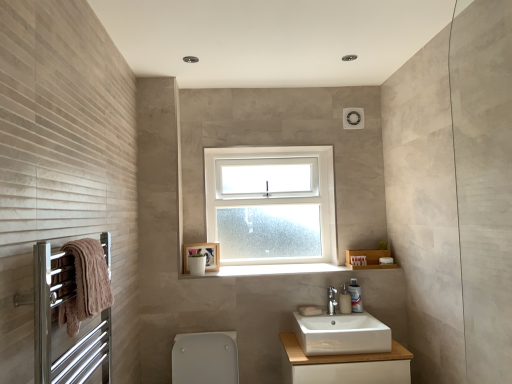
What are the coordinates of `white smooth window sill at center` in the screenshot? It's located at (288, 269).

What do you see at coordinates (205, 358) in the screenshot? I see `white glossy toilet bowl at lower center` at bounding box center [205, 358].

What is the approximate height of brown towel at left?

It is 9.38 inches.

Image resolution: width=512 pixels, height=384 pixels. In order to click on silver metallic towel rack at left in this screenshot , I will do `click(59, 327)`.

Which of these two, white glossy cabinet at lower center or white frosted glass window at center, is smaller?

Smaller between the two is white frosted glass window at center.

Is white glossy cabinet at lower center situated inside white frosted glass window at center or outside?

white glossy cabinet at lower center lies outside white frosted glass window at center.

Can you tell me how much white glossy cabinet at lower center and white frosted glass window at center differ in facing direction?

They differ by 0.0271 degrees in their facing directions.

Based on the photo, from a real-world perspective, is white glossy cabinet at lower center positioned above or below white frosted glass window at center?

In terms of real-world spatial position, white glossy cabinet at lower center is below white frosted glass window at center.

From a real-world perspective, is white smooth window sill at center physically below white glossy cabinet at lower center?

No, from a real-world perspective, white smooth window sill at center is not under white glossy cabinet at lower center.

Are white smooth window sill at center and white glossy cabinet at lower center beside each other?

white smooth window sill at center and white glossy cabinet at lower center are not in contact.

Can you tell me how much white smooth window sill at center and white glossy cabinet at lower center differ in facing direction?

The angular difference between white smooth window sill at center and white glossy cabinet at lower center is 0.117 degrees.

In terms of size, does white smooth window sill at center appear bigger or smaller than white glossy cabinet at lower center?

white smooth window sill at center is smaller than white glossy cabinet at lower center.

Identify the location of window sill above the white ceramic sink at center (from a real-world perspective). This screenshot has width=512, height=384. (288, 269).

Is point (312, 332) closer or farther from the camera than point (348, 270)?

Point (312, 332) appears to be closer to the viewer than point (348, 270).

Between white ceramic sink at center and white smooth window sill at center, which one has smaller size?

white smooth window sill at center is smaller.

Which object is positioned more to the left, white glossy soap dispenser at lower right or brown towel at left?

From the viewer's perspective, brown towel at left appears more on the left side.

In the scene shown: Is white glossy soap dispenser at lower right far from brown towel at left?

Yes, white glossy soap dispenser at lower right and brown towel at left are quite far apart.

How many degrees apart are the facing directions of white glossy soap dispenser at lower right and brown towel at left?

The angle between the facing direction of white glossy soap dispenser at lower right and the facing direction of brown towel at left is 89.9 degrees.

Does white glossy soap dispenser at lower right come behind brown towel at left?

That is True.

From the image's perspective, is white glossy cabinet at lower center beneath silver metallic towel rack at left?

Indeed, from the image's perspective, white glossy cabinet at lower center is shown beneath silver metallic towel rack at left.

Looking at this image, which of these two, white glossy cabinet at lower center or silver metallic towel rack at left, stands shorter?

Standing shorter between the two is white glossy cabinet at lower center.

Identify the location of bathroom cabinet below the silver metallic towel rack at left (from the image's perspective). (344, 365).

Considering the relative sizes of white glossy cabinet at lower center and silver metallic towel rack at left in the image provided, is white glossy cabinet at lower center smaller than silver metallic towel rack at left?

Actually, white glossy cabinet at lower center might be larger than silver metallic towel rack at left.

From the image's perspective, is white frosted glass window at center beneath white ceramic tap at center?

Actually, white frosted glass window at center appears above white ceramic tap at center in the image.

Which of these two, white frosted glass window at center or white ceramic tap at center, stands taller?

Standing taller between the two is white frosted glass window at center.

Which object is more forward, white frosted glass window at center or white ceramic tap at center?

white ceramic tap at center.

In terms of size, does white frosted glass window at center appear bigger or smaller than white ceramic tap at center?

Clearly, white frosted glass window at center is larger in size than white ceramic tap at center.

Between white glossy cabinet at lower center and white smooth window sill at center, which one has larger size?

white glossy cabinet at lower center.

From a real-world perspective, which is physically below, white glossy cabinet at lower center or white smooth window sill at center?

From a 3D spatial view, white glossy cabinet at lower center is below.

Locate an element on the screen. This screenshot has width=512, height=384. bathroom cabinet below the white smooth window sill at center (from a real-world perspective) is located at coordinates (344, 365).

Is white glossy cabinet at lower center taller or shorter than white smooth window sill at center?

white glossy cabinet at lower center is taller than white smooth window sill at center.

The height and width of the screenshot is (384, 512). In order to click on window lying above the white glossy cabinet at lower center (from the image's perspective) in this screenshot , I will do `click(271, 204)`.

The width and height of the screenshot is (512, 384). What are the coordinates of `bathroom cabinet below the white smooth window sill at center (from a real-world perspective)` in the screenshot? It's located at (344, 365).

Estimate the real-world distances between objects in this image. Which object is closer to white glossy soap dispenser at lower right, white frosted glass window at center or white glossy cabinet at lower center?

white glossy cabinet at lower center.

When comparing their distances from white glossy cabinet at lower center, does white frosted glass window at center or white glossy soap dispenser at lower right seem closer?

The object closer to white glossy cabinet at lower center is white glossy soap dispenser at lower right.

Consider the image. Which object lies nearer to the anchor point brown towel at left, white smooth window sill at center or silver metallic towel rack at left?

silver metallic towel rack at left.

Based on their spatial positions, is white glossy cabinet at lower center or white glossy soap dispenser at lower center closer to white ceramic tap at center?

white glossy soap dispenser at lower center lies closer to white ceramic tap at center than the other object.

Estimate the real-world distances between objects in this image. Which object is closer to white ceramic sink at center, white glossy toilet bowl at lower center or white glossy cabinet at lower center?

The object closer to white ceramic sink at center is white glossy cabinet at lower center.

Estimate the real-world distances between objects in this image. Which object is further from white glossy cabinet at lower center, white frosted glass window at center or white glossy soap dispenser at lower center?

white frosted glass window at center is positioned further to the anchor white glossy cabinet at lower center.

Looking at the image, which one is located closer to white smooth window sill at center, white glossy soap dispenser at lower center or white glossy toilet bowl at lower center?

The object closer to white smooth window sill at center is white glossy soap dispenser at lower center.

Estimate the real-world distances between objects in this image. Which object is closer to silver metallic towel rack at left, white glossy soap dispenser at lower right or white ceramic sink at center?

white ceramic sink at center lies closer to silver metallic towel rack at left than the other object.

You are a GUI agent. You are given a task and a screenshot of the screen. Output one action in this format:
    pyautogui.click(x=<x>, y=<y>)
    Task: Click on the toiletry between silver metallic towel rack at left and white frosted glass window at center from front to back
    This screenshot has width=512, height=384.
    Given the screenshot: What is the action you would take?
    pyautogui.click(x=355, y=296)

Where is `tap between white ceramic sink at center and white smooth window sill at center in the front-back direction`? The image size is (512, 384). tap between white ceramic sink at center and white smooth window sill at center in the front-back direction is located at coordinates (331, 300).

At what (x,y) coordinates should I click in order to perform the action: click on toilet bowl positioned between silver metallic towel rack at left and white glossy soap dispenser at lower right from near to far. Please return your answer as a coordinate pair (x, y). The height and width of the screenshot is (384, 512). Looking at the image, I should click on (205, 358).

Find the location of a particular element. The width and height of the screenshot is (512, 384). soap dispenser between brown towel at left and white ceramic tap at center along the z-axis is located at coordinates (345, 300).